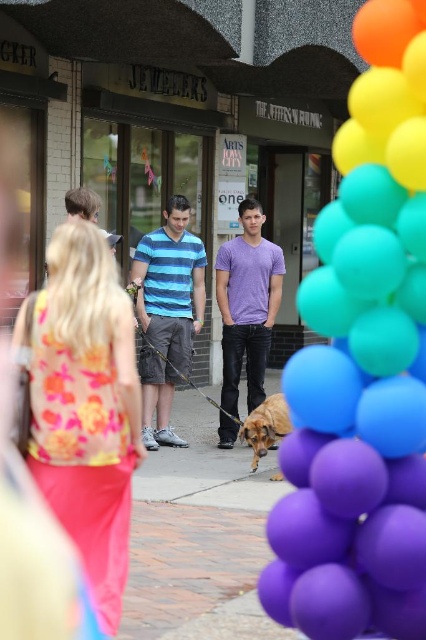
Question: Does blue striped shirt at center appear under brown matte dog at center?

Choices:
 (A) yes
 (B) no

Answer: (B)

Question: Does purple matte balloons at right appear under blue striped shirt at center?

Choices:
 (A) no
 (B) yes

Answer: (A)

Question: Which point appears closest to the camera in this image?

Choices:
 (A) (161, 289)
 (B) (253, 262)

Answer: (A)

Question: Is blue striped shirt at center behind brown matte dog at center?

Choices:
 (A) yes
 (B) no

Answer: (A)

Question: Which of the following is the farthest from the observer?

Choices:
 (A) purple matte shirt at center
 (B) brown matte dog at center
 (C) purple matte balloons at right
 (D) blue striped shirt at center

Answer: (A)

Question: Which point is farther to the camera?

Choices:
 (A) purple matte balloons at right
 (B) purple matte shirt at center

Answer: (B)